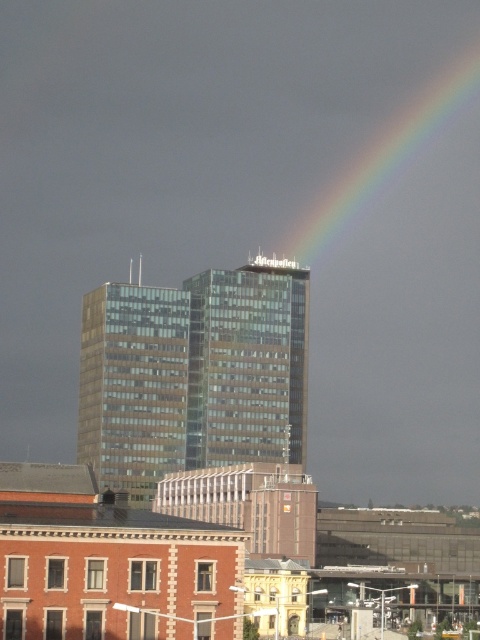
Is point (245, 285) positioned behind point (310, 44)?

That is False.

From the picture: Between transparent glass building at center and rainbow at upper right, which one is positioned higher?

Positioned higher is rainbow at upper right.

In order to click on transparent glass building at center in this screenshot , I will do `click(192, 374)`.